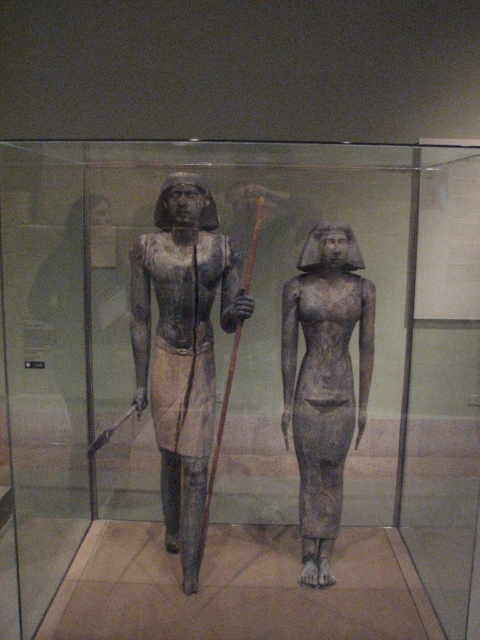
Question: Among these objects, which one is farthest from the camera?

Choices:
 (A) gray stone statue at center
 (B) matte stone statue at center

Answer: (A)

Question: In this image, where is matte stone statue at center located relative to gray stone statue at center?

Choices:
 (A) left
 (B) right

Answer: (A)

Question: Which of the following is the farthest from the observer?

Choices:
 (A) gray stone statue at center
 (B) matte stone statue at center

Answer: (A)

Question: Is the position of matte stone statue at center more distant than that of gray stone statue at center?

Choices:
 (A) yes
 (B) no

Answer: (B)

Question: Is matte stone statue at center to the right of gray stone statue at center from the viewer's perspective?

Choices:
 (A) yes
 (B) no

Answer: (B)